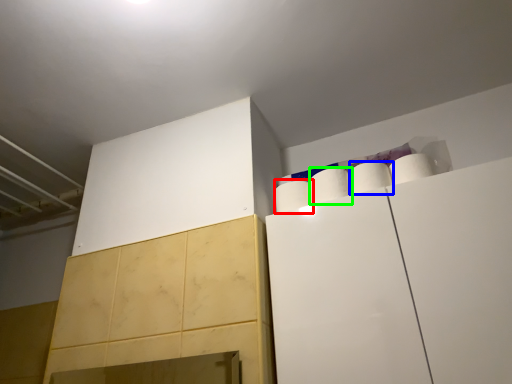
Question: Considering the real-world distances, which object is farthest from paper towel (highlighted by a red box)? paper towel (highlighted by a blue box) or paper towel (highlighted by a green box)?

Choices:
 (A) paper towel
 (B) paper towel

Answer: (A)